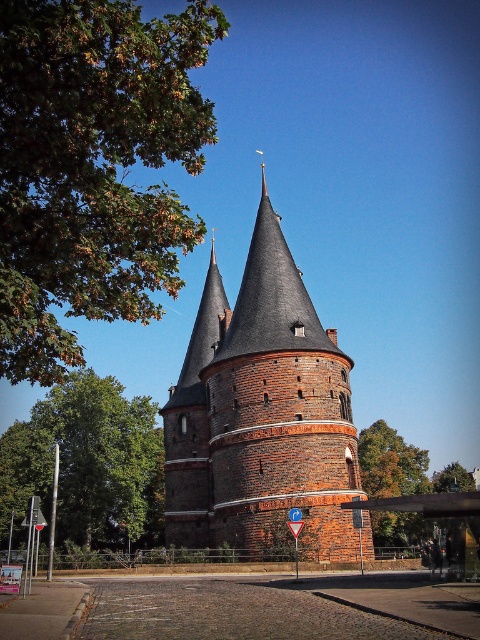
You are a city planner assessing the historic tower and a nearby street sign. Given the brick tower at center and the metallic street sign at lower left, which one has a greater height?

The brick tower at center is taller than the metallic street sign at lower left.

You are a tourist standing at the entrance of a historic park and see the brick tower at center. You want to take a photo of it from a distance where it will appear as large as possible in your camera frame. The camera has a maximum zoom range of 100 meters. Should you move closer or stay at your current position to achieve this?

The brick tower at center is currently 52.22 meters away from you. Since your camera can zoom up to 100 meters, you can move closer to the brick tower at center to make it appear larger in the photo. Moving closer within the camera range will allow the tower to fill more of the frame.

You are standing in front of the historic brick tower and notice two green leafy trees. One is labeled as green leafy tree at left and the other as green leafy tree at center. From your perspective, which tree is positioned further to the left?

The green leafy tree at left is positioned further to the left compared to the green leafy tree at center.